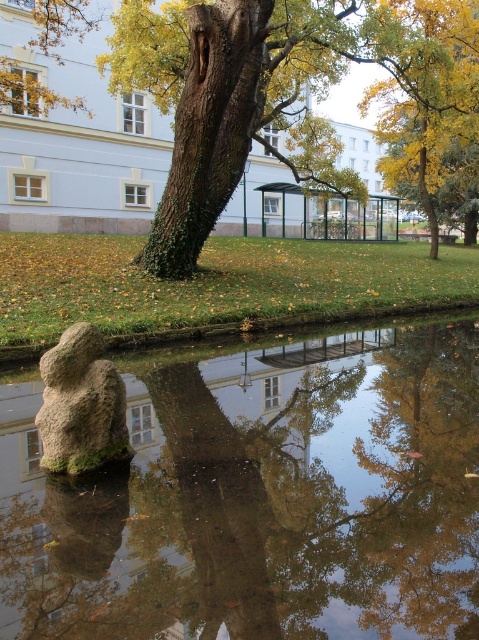
You are standing at the bus stop shelter and want to walk to the gray rough stone at lower left without stepping on the green rough bark tree at center. Which direction should you move relative to the tree?

The green rough bark tree at center is to the left of the gray rough stone at lower left. To reach the gray rough stone at lower left without stepping on the tree, you should move to the right side of the tree.

You are standing at the center of the image and want to take a photo of the green rough bark tree at center. In which direction should you move to get a better view of the tree?

The green rough bark tree at center is already at the center of the image, so you don not need to move to get a better view of it.